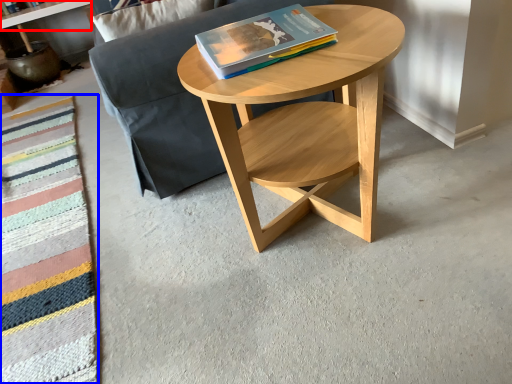
Question: Which object is closer to the camera taking this photo, shelf (highlighted by a red box) or blanket (highlighted by a blue box)?

Choices:
 (A) shelf
 (B) blanket

Answer: (B)